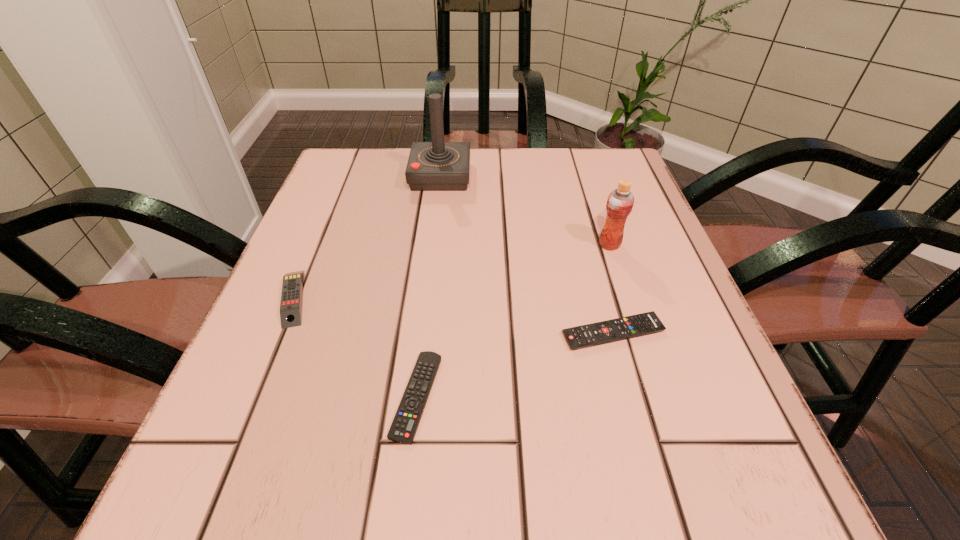
This screenshot has height=540, width=960. Identify the location of free space in the image that satisfies the following two spatial constraints: 1. on the rectangular base of the second tallest remote control; 2. on the right side of the farthest object. (421, 333).

Locate an element on the screen. This screenshot has width=960, height=540. vacant space that satisfies the following two spatial constraints: 1. on the rectangular base of the joystick; 2. on the left side of the fourth nearest object is located at coordinates (432, 245).

Where is `free space that satisfies the following two spatial constraints: 1. on the back side of the nearest object; 2. on the rectangular base of the tallest object`? Image resolution: width=960 pixels, height=540 pixels. free space that satisfies the following two spatial constraints: 1. on the back side of the nearest object; 2. on the rectangular base of the tallest object is located at coordinates (443, 176).

I want to click on free location that satisfies the following two spatial constraints: 1. on the rectangular base of the joystick; 2. on the left side of the fourth nearest object, so click(432, 245).

I want to click on vacant area in the image that satisfies the following two spatial constraints: 1. on the rectangular base of the second tallest object; 2. on the left side of the tallest object, so click(x=432, y=245).

This screenshot has height=540, width=960. I want to click on vacant position in the image that satisfies the following two spatial constraints: 1. on the rectangular base of the rightmost remote control; 2. on the left side of the farthest object, so click(421, 333).